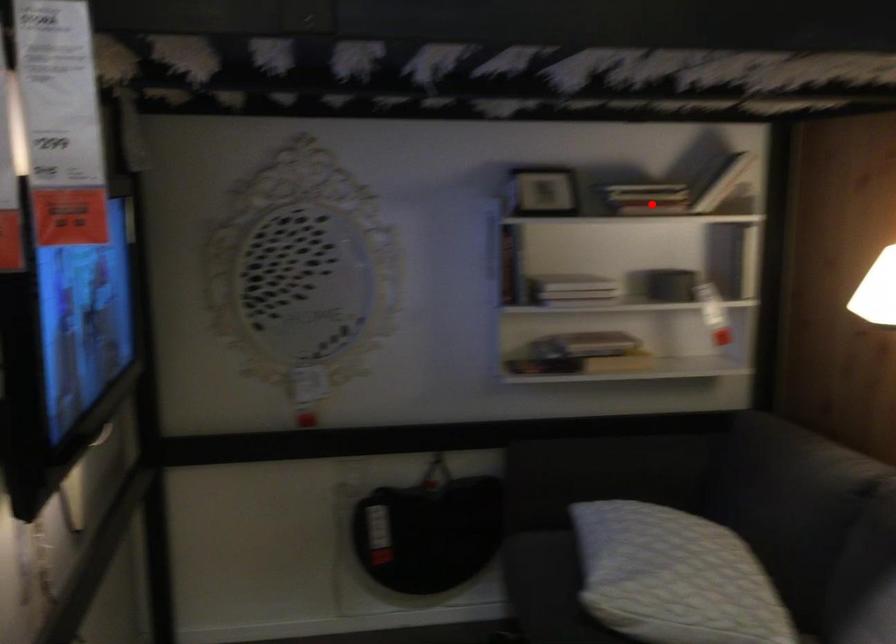
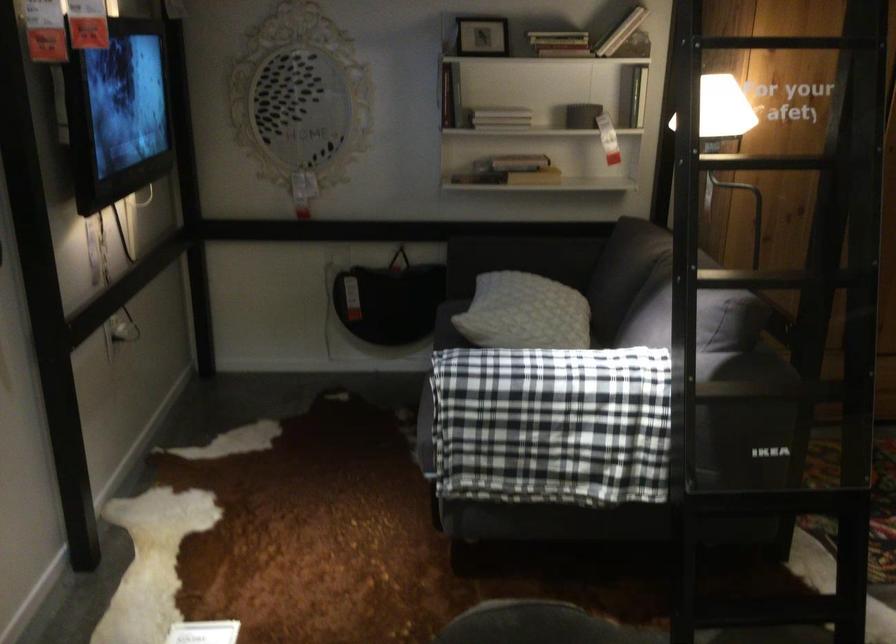
Question: I am providing you with two images of the same scene from different viewpoints. A red point is marked on the first image. At the location where the point appears in image 1, is it still visible in image 2?

Choices:
 (A) Yes
 (B) No

Answer: (A)